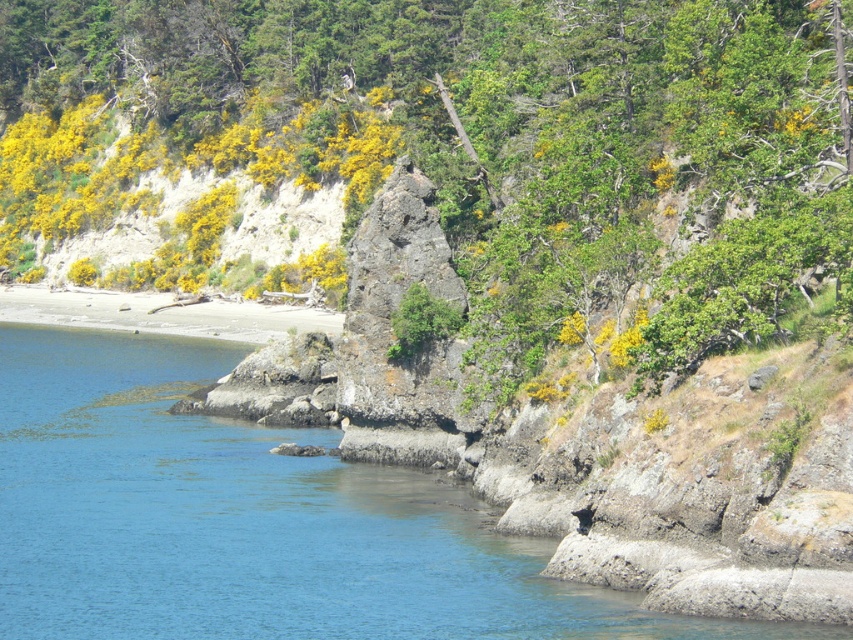
Question: Among these points, which one is farthest from the camera?

Choices:
 (A) (611, 616)
 (B) (787, 28)

Answer: (B)

Question: Which object is positioned closest to the green leafy tree at center?

Choices:
 (A) sandy beach at lower left
 (B) clear blue water at lower left

Answer: (A)

Question: Which point is closer to the camera taking this photo?

Choices:
 (A) (294, 35)
 (B) (595, 612)

Answer: (B)

Question: Is clear blue water at lower left below sandy beach at lower left?

Choices:
 (A) no
 (B) yes

Answer: (B)

Question: Considering the relative positions of green leafy tree at center and clear blue water at lower left in the image provided, where is green leafy tree at center located with respect to clear blue water at lower left?

Choices:
 (A) below
 (B) above

Answer: (B)

Question: Is clear blue water at lower left smaller than sandy beach at lower left?

Choices:
 (A) yes
 (B) no

Answer: (B)